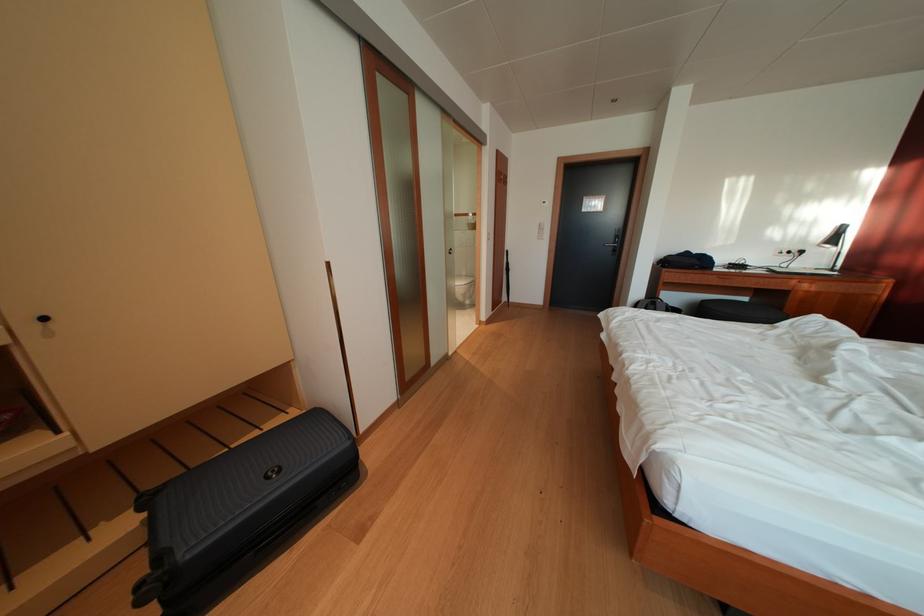
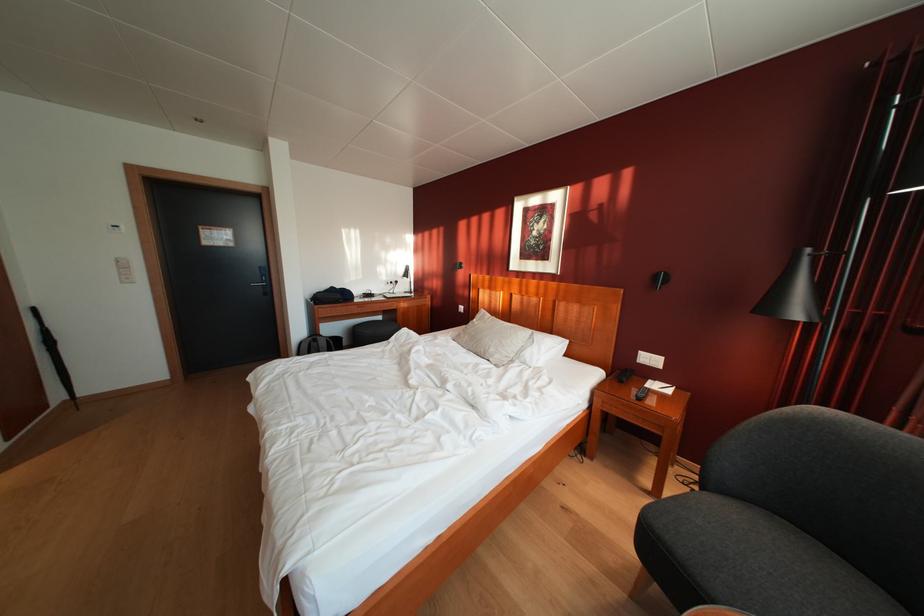
Question: How did the camera likely rotate?

Choices:
 (A) Left
 (B) Right
 (C) Up
 (D) Down

Answer: (B)